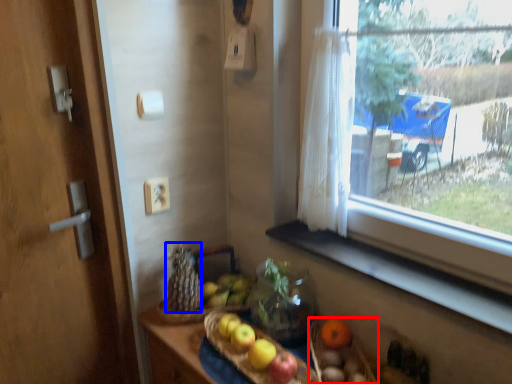
Question: Which point is closer to the camera, basket (highlighted by a red box) or food (highlighted by a blue box)?

Choices:
 (A) basket
 (B) food

Answer: (A)